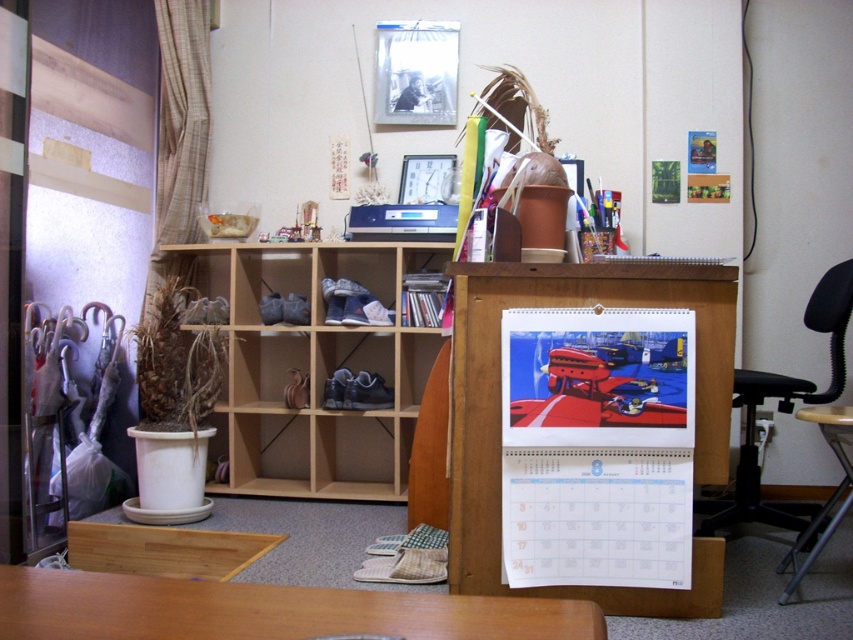
Who is positioned more to the right, wooden at center or black plastic swivel chair at lower right?

black plastic swivel chair at lower right

Between wooden at center and black plastic swivel chair at lower right, which one is positioned higher?

wooden at center

Between point (492, 472) and point (793, 547), which one is positioned in front?

Point (492, 472) is more forward.

Where is `wooden at center`? The height and width of the screenshot is (640, 853). wooden at center is located at coordinates (498, 410).

Who is higher up, wooden table at lower center or black plastic swivel chair at lower right?

wooden table at lower center is higher up.

Between wooden table at lower center and black plastic swivel chair at lower right, which one has more height?

With more height is black plastic swivel chair at lower right.

Where is `wooden table at lower center`? wooden table at lower center is located at coordinates (265, 611).

Locate an element on the screen. The image size is (853, 640). wooden table at lower center is located at coordinates (265, 611).

Describe the element at coordinates (498, 410) in the screenshot. I see `wooden at center` at that location.

Which is behind, point (457, 349) or point (538, 602)?

Positioned behind is point (457, 349).

I want to click on wooden at center, so click(498, 410).